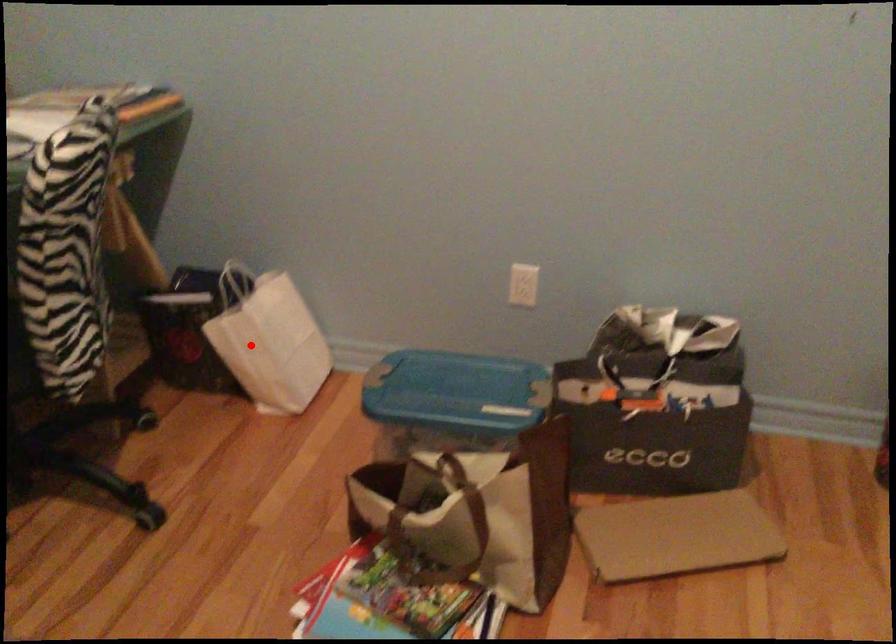
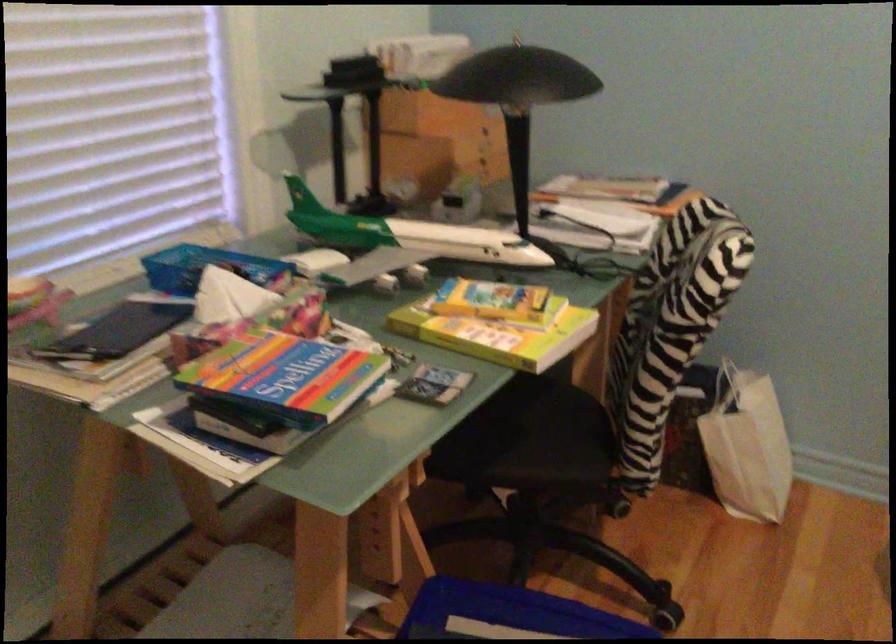
The point at the highlighted location is marked in the first image. Where is the corresponding point in the second image?

(746, 446)